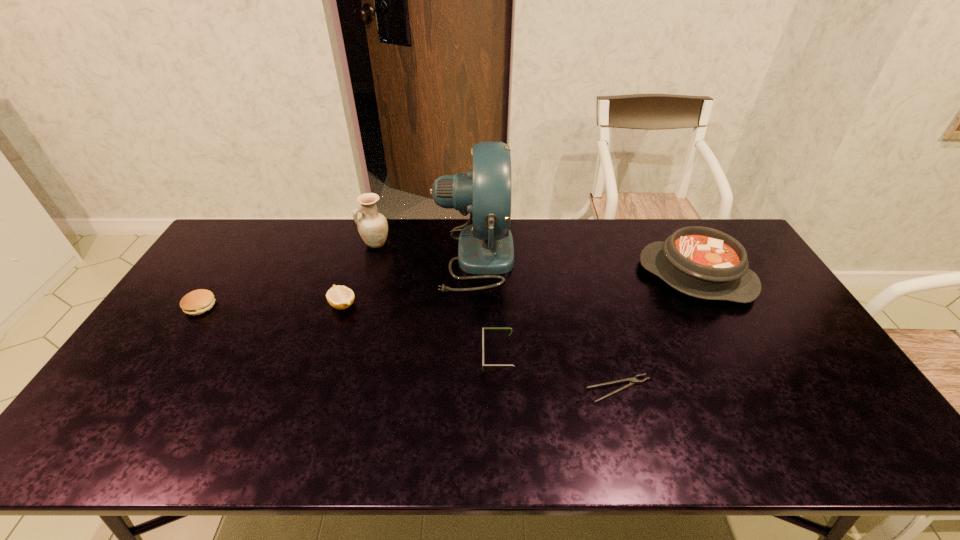
Where is `empty space that is in between the pottery and the spectacles`? The image size is (960, 540). empty space that is in between the pottery and the spectacles is located at coordinates (437, 300).

The width and height of the screenshot is (960, 540). In order to click on vacant area that lies between the casserole and the lemon in this screenshot , I will do `click(519, 291)`.

Find the location of `vacant area that lies between the lemon and the fifth shortest object`. vacant area that lies between the lemon and the fifth shortest object is located at coordinates (519, 291).

This screenshot has height=540, width=960. I want to click on vacant space that's between the rightmost object and the spectacles, so click(x=596, y=316).

I want to click on free space that is in between the fan and the lemon, so click(x=409, y=280).

At what (x,y) coordinates should I click in order to perform the action: click on free space between the patty and the spectacles. Please return your answer as a coordinate pair (x, y). Image resolution: width=960 pixels, height=540 pixels. Looking at the image, I should click on (349, 331).

I want to click on free space between the rightmost object and the spectacles, so click(596, 316).

Image resolution: width=960 pixels, height=540 pixels. I want to click on free space between the fan and the spectacles, so click(x=486, y=306).

Where is `free spot between the tallest object and the casserole`? free spot between the tallest object and the casserole is located at coordinates (585, 266).

The width and height of the screenshot is (960, 540). What are the coordinates of `object identified as the second closest to the tallest object` in the screenshot? It's located at (483, 365).